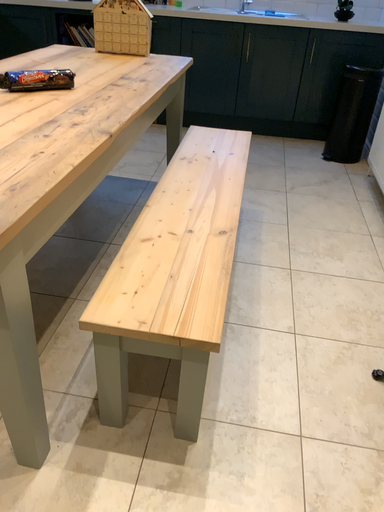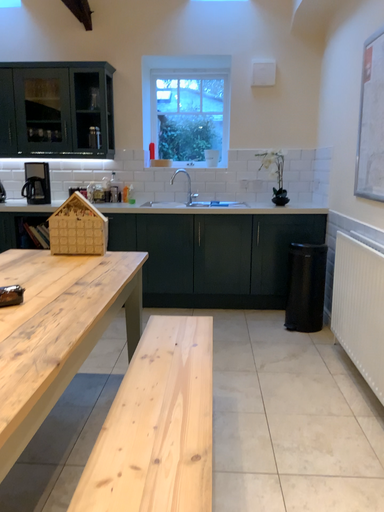
Question: Which way did the camera rotate in the video?

Choices:
 (A) rotated upward
 (B) rotated downward

Answer: (A)